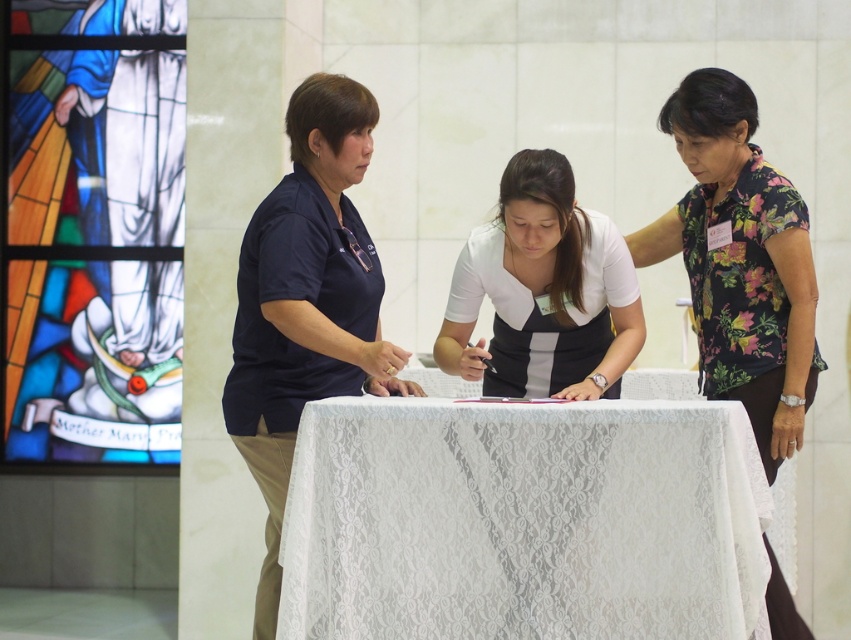
Question: Does white lace tablecloth at center appear under white matte shirt at center?

Choices:
 (A) no
 (B) yes

Answer: (B)

Question: Can you confirm if floral print blouse at center is positioned above white matte shirt at center?

Choices:
 (A) yes
 (B) no

Answer: (B)

Question: Can you confirm if stained glass window at upper left is wider than dark blue shirt at center?

Choices:
 (A) yes
 (B) no

Answer: (A)

Question: Among these objects, which one is farthest from the camera?

Choices:
 (A) white lace tablecloth at center
 (B) white matte shirt at center
 (C) stained glass window at upper left

Answer: (C)

Question: Which point is farther to the camera?

Choices:
 (A) (724, 388)
 (B) (254, 390)
 (C) (752, 611)

Answer: (A)

Question: Which object appears farthest from the camera in this image?

Choices:
 (A) white lace tablecloth at center
 (B) stained glass window at upper left
 (C) dark blue shirt at center
 (D) floral print blouse at center

Answer: (B)